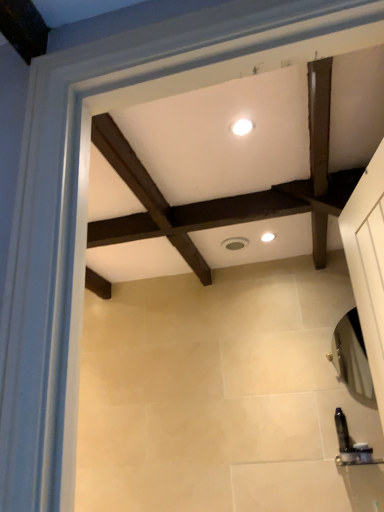
Question: Which direction should I rotate to look at white glossy light fixture at center, the second lighting from the left?

Choices:
 (A) right
 (B) left

Answer: (A)

Question: Is translucent plastic soap dispenser at lower right, which appears as the 2th toiletry when viewed from the left, at the left side of white glossy light fixture at upper center, the 2th lighting from the right?

Choices:
 (A) yes
 (B) no

Answer: (B)

Question: Can you confirm if translucent plastic soap dispenser at lower right, which appears as the 2th toiletry when viewed from the left, is smaller than white glossy light fixture at upper center, acting as the first lighting starting from the front?

Choices:
 (A) no
 (B) yes

Answer: (A)

Question: From a real-world perspective, is translucent plastic soap dispenser at lower right, which appears as the 2th toiletry when viewed from the left, located higher than white glossy light fixture at upper center, acting as the first lighting starting from the front?

Choices:
 (A) no
 (B) yes

Answer: (A)

Question: Is translucent plastic soap dispenser at lower right, which appears as the 2th toiletry when viewed from the left, in contact with white glossy light fixture at upper center, acting as the first lighting starting from the front?

Choices:
 (A) no
 (B) yes

Answer: (A)

Question: Is translucent plastic soap dispenser at lower right, which appears as the 2th toiletry when viewed from the left, positioned before white glossy light fixture at upper center, acting as the first lighting starting from the front?

Choices:
 (A) no
 (B) yes

Answer: (A)

Question: Is white glossy light fixture at upper center, acting as the first lighting starting from the front, a part of translucent plastic soap dispenser at lower right, which is the first toiletry from right to left?

Choices:
 (A) yes
 (B) no

Answer: (B)

Question: Is black plastic toiletry at lower right, acting as the 2th toiletry starting from the right, closer to the viewer compared to white glossy light fixture at upper center, the second lighting in the bottom-to-top sequence?

Choices:
 (A) yes
 (B) no

Answer: (B)

Question: From the image's perspective, is black plastic toiletry at lower right, acting as the 1th toiletry starting from the left, under white glossy light fixture at upper center, the 2th lighting from the right?

Choices:
 (A) yes
 (B) no

Answer: (A)

Question: Is the depth of black plastic toiletry at lower right, acting as the 2th toiletry starting from the right, greater than that of white glossy light fixture at upper center, positioned as the 1th lighting in left-to-right order?

Choices:
 (A) no
 (B) yes

Answer: (B)

Question: Considering the relative sizes of black plastic toiletry at lower right, acting as the 2th toiletry starting from the right, and white glossy light fixture at upper center, positioned as the 1th lighting in left-to-right order, in the image provided, is black plastic toiletry at lower right, acting as the 2th toiletry starting from the right, bigger than white glossy light fixture at upper center, positioned as the 1th lighting in left-to-right order,?

Choices:
 (A) yes
 (B) no

Answer: (A)

Question: Is white glossy light fixture at upper center, positioned as the 1th lighting in left-to-right order, a part of black plastic toiletry at lower right, acting as the 2th toiletry starting from the right?

Choices:
 (A) no
 (B) yes

Answer: (A)

Question: Considering the relative sizes of black plastic toiletry at lower right, acting as the 2th toiletry starting from the right, and white glossy light fixture at upper center, placed as the 1th lighting when sorted from top to bottom, in the image provided, is black plastic toiletry at lower right, acting as the 2th toiletry starting from the right, thinner than white glossy light fixture at upper center, placed as the 1th lighting when sorted from top to bottom,?

Choices:
 (A) no
 (B) yes

Answer: (B)

Question: Does white glossy light fixture at upper center, acting as the first lighting starting from the front, have a smaller size compared to white glossy light fixture at center, which is counted as the 1th lighting, starting from the back?

Choices:
 (A) no
 (B) yes

Answer: (B)